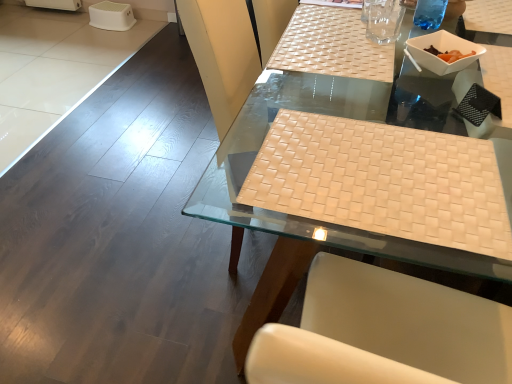
At what (x,y) coordinates should I click in order to perform the action: click on vacant space to the right of transparent glass at upper center. Please return your answer as a coordinate pair (x, y). This screenshot has height=384, width=512. Looking at the image, I should click on [431, 41].